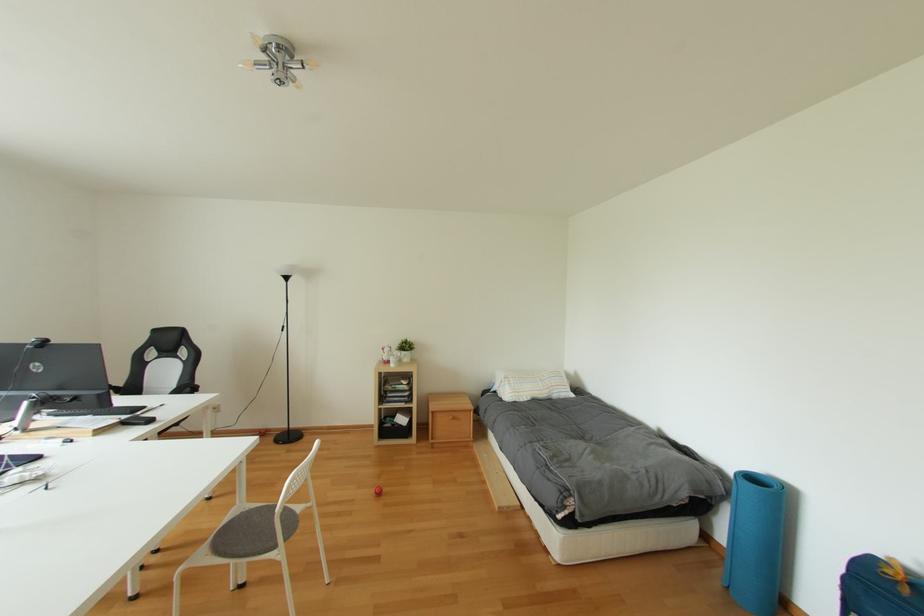
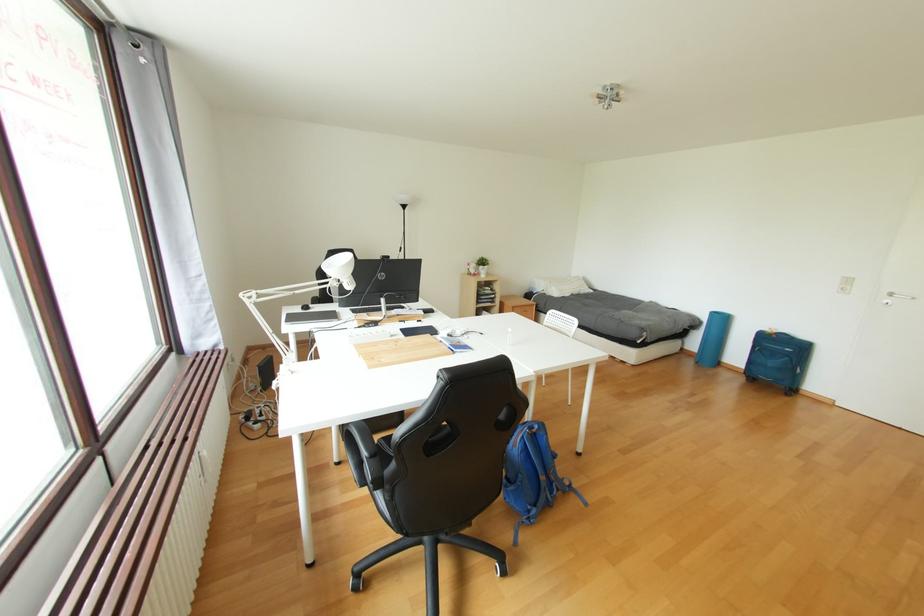
Question: In a continuous first-person perspective shot, in which direction is the camera moving?

Choices:
 (A) Left
 (B) Right
 (C) Forward
 (D) Backward

Answer: (A)